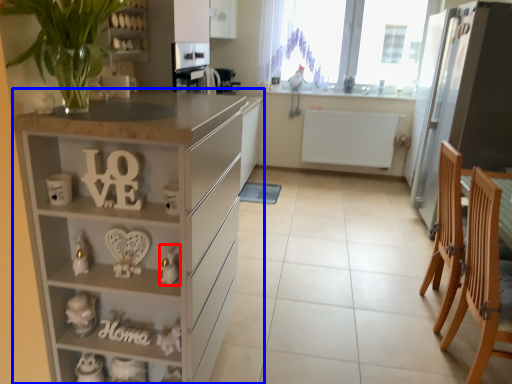
Question: Among these objects, which one is nearest to the camera, toy (highlighted by a red box) or cabinetry (highlighted by a blue box)?

Choices:
 (A) toy
 (B) cabinetry

Answer: (B)